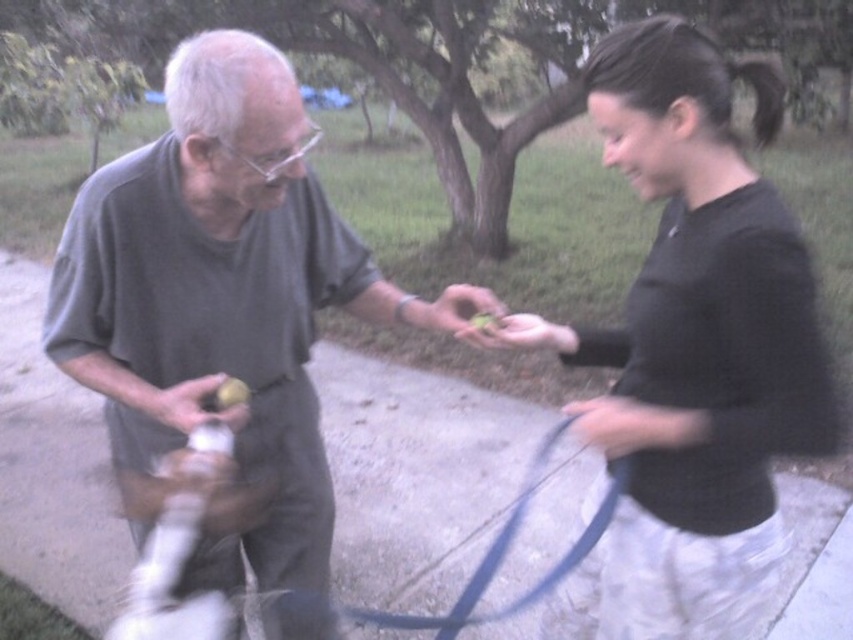
Is smooth black glove at lower center below matte white spray can at center?

Yes, smooth black glove at lower center is below matte white spray can at center.

Does point (630, 435) come in front of point (213, 413)?

That is True.

Describe the element at coordinates (616, 424) in the screenshot. I see `smooth black glove at lower center` at that location.

Locate an element on the screen. smooth black glove at lower center is located at coordinates (616, 424).

Who is more distant from viewer, (550, 432) or (550, 332)?

Point (550, 432)

Does blue rubber leash at lower center have a lesser height compared to smooth green apple at center?

In fact, blue rubber leash at lower center may be taller than smooth green apple at center.

Does point (619, 460) come farther from viewer compared to point (479, 340)?

No, it is in front of (479, 340).

In order to click on blue rubber leash at lower center in this screenshot , I will do `click(502, 557)`.

Which is more to the right, smooth green apple at center or yellow matte apple at center?

From the viewer's perspective, smooth green apple at center appears more on the right side.

Which is above, smooth green apple at center or yellow matte apple at center?

Positioned higher is smooth green apple at center.

Find the location of `smooth green apple at center`. smooth green apple at center is located at coordinates (521, 333).